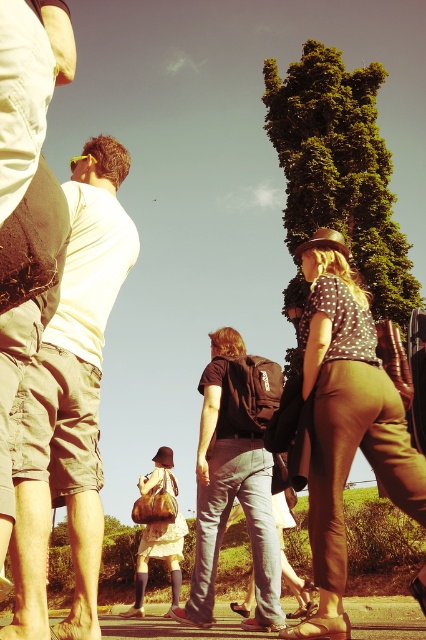
You are a photographer trying to capture the scene. You notice the brown leather pants at right and the concrete pavement at lower center. Which object appears shorter in the image?

The brown leather pants at right appears shorter than the concrete pavement at lower center in the image.

You are standing on the concrete pavement at lower center and want to walk towards the brown leather pants at right. Is the path clear?

The brown leather pants at right is positioned over concrete pavement at lower center, so the path is clear as the concrete pavement at lower center extends under the brown leather pants at right.